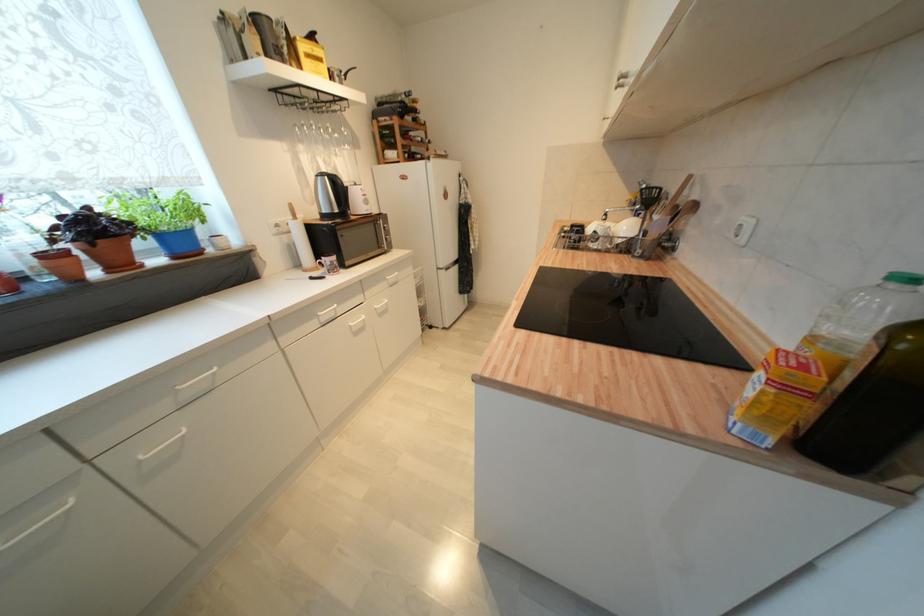
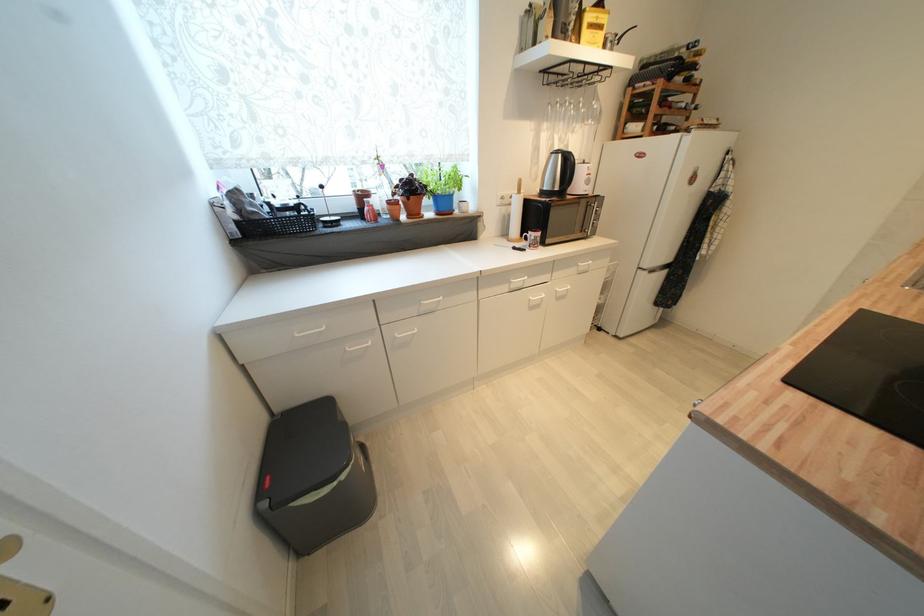
In the second image, find the point that corresponds to point (334, 265) in the first image.

(538, 240)